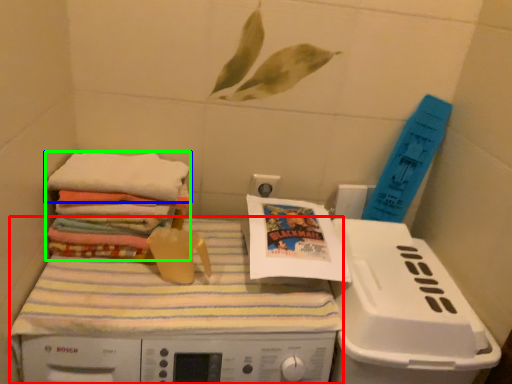
Question: Considering the real-world distances, which object is farthest from machine (highlighted by a red box)? towel (highlighted by a blue box) or material (highlighted by a green box)?

Choices:
 (A) towel
 (B) material

Answer: (A)